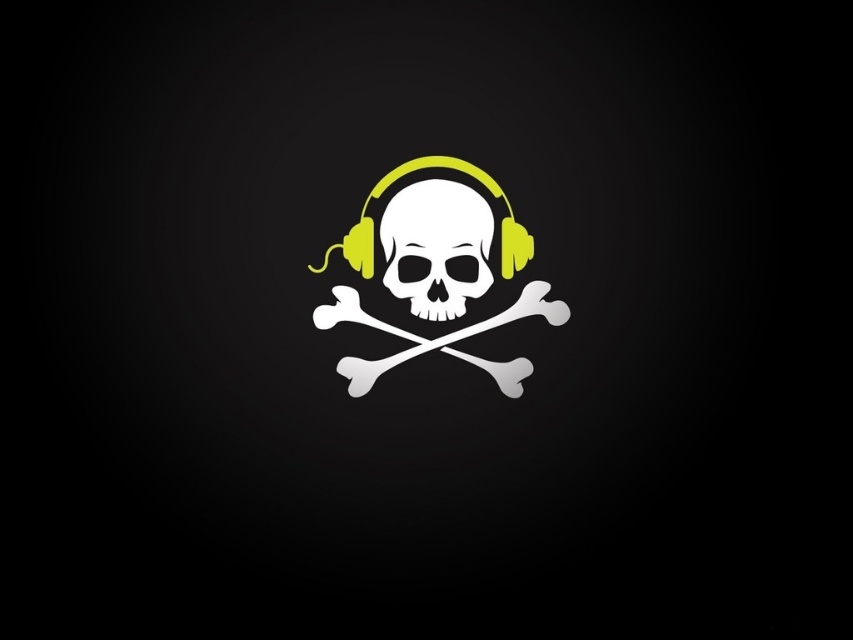
Which of these two, white matte skull and crossbones at center or white matte skull at center, stands taller?

white matte skull and crossbones at center is taller.

Is point (463, 260) farther from camera compared to point (434, 179)?

Yes, point (463, 260) is farther from viewer.

Does point (442, 278) come behind point (440, 232)?

Yes.

Identify the location of white matte skull and crossbones at center. (436, 237).